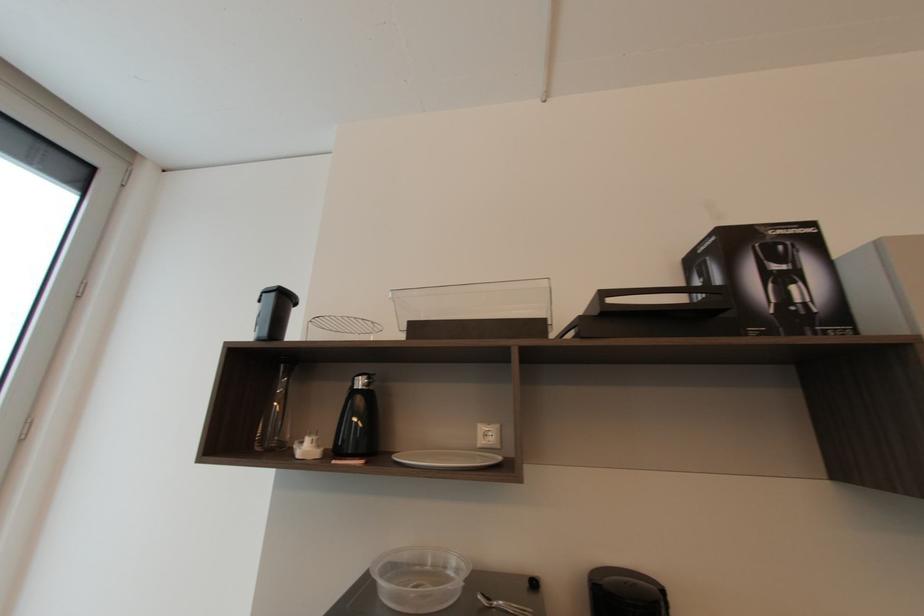
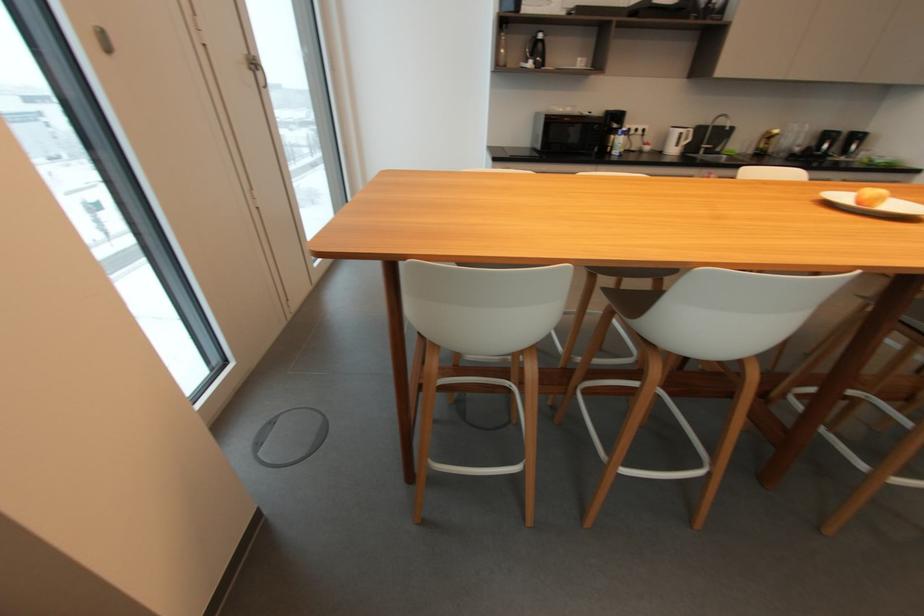
Locate, in the second image, the point that corresponds to [362,384] in the first image.

(544, 36)